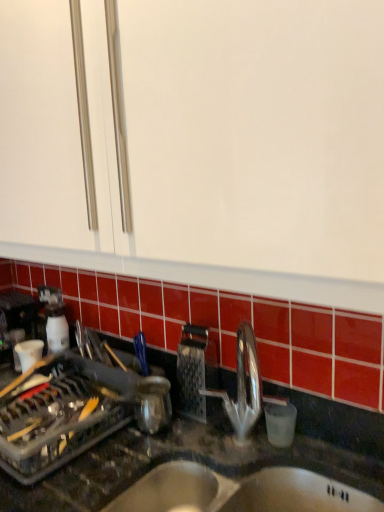
Question: Is metallic grater at center beside black granite countertop at center?

Choices:
 (A) yes
 (B) no

Answer: (B)

Question: Considering the relative sizes of metallic grater at center and black granite countertop at center in the image provided, is metallic grater at center thinner than black granite countertop at center?

Choices:
 (A) yes
 (B) no

Answer: (A)

Question: From the image's perspective, does metallic grater at center appear higher than black granite countertop at center?

Choices:
 (A) yes
 (B) no

Answer: (A)

Question: From the image's perspective, does metallic grater at center appear lower than black granite countertop at center?

Choices:
 (A) no
 (B) yes

Answer: (A)

Question: Is metallic grater at center oriented away from black granite countertop at center?

Choices:
 (A) yes
 (B) no

Answer: (B)

Question: Does metallic grater at center turn towards black granite countertop at center?

Choices:
 (A) yes
 (B) no

Answer: (B)

Question: From the image's perspective, is stainless steel sink at lower center over black granite countertop at center?

Choices:
 (A) yes
 (B) no

Answer: (B)

Question: Can you confirm if stainless steel sink at lower center is taller than black granite countertop at center?

Choices:
 (A) no
 (B) yes

Answer: (A)

Question: Is stainless steel sink at lower center positioned in front of black granite countertop at center?

Choices:
 (A) no
 (B) yes

Answer: (A)

Question: Is stainless steel sink at lower center completely or partially outside of black granite countertop at center?

Choices:
 (A) yes
 (B) no

Answer: (B)

Question: Is stainless steel sink at lower center looking in the opposite direction of black granite countertop at center?

Choices:
 (A) no
 (B) yes

Answer: (B)

Question: From a real-world perspective, is stainless steel sink at lower center under black granite countertop at center?

Choices:
 (A) yes
 (B) no

Answer: (A)

Question: Can you confirm if metallic grater at center is shorter than stainless steel sink at lower center?

Choices:
 (A) no
 (B) yes

Answer: (A)